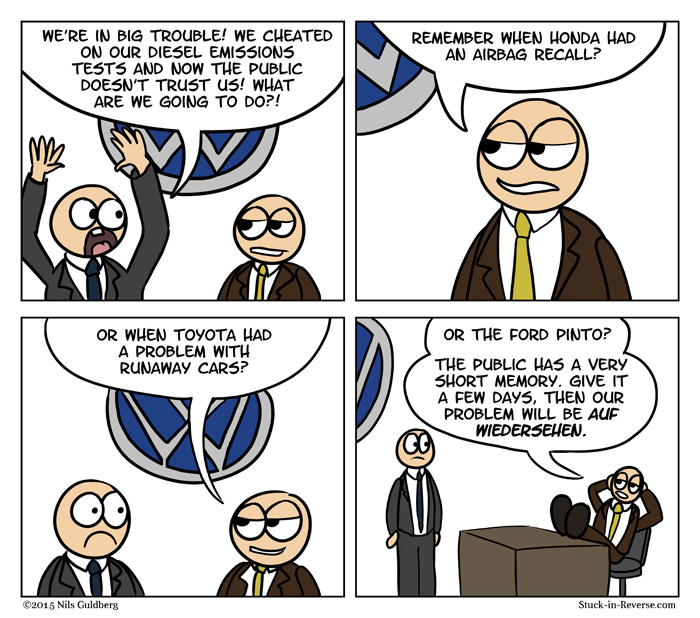
Where is `white wall`? The image size is (700, 618). white wall is located at coordinates (315, 446), (371, 468), (402, 177), (323, 190).